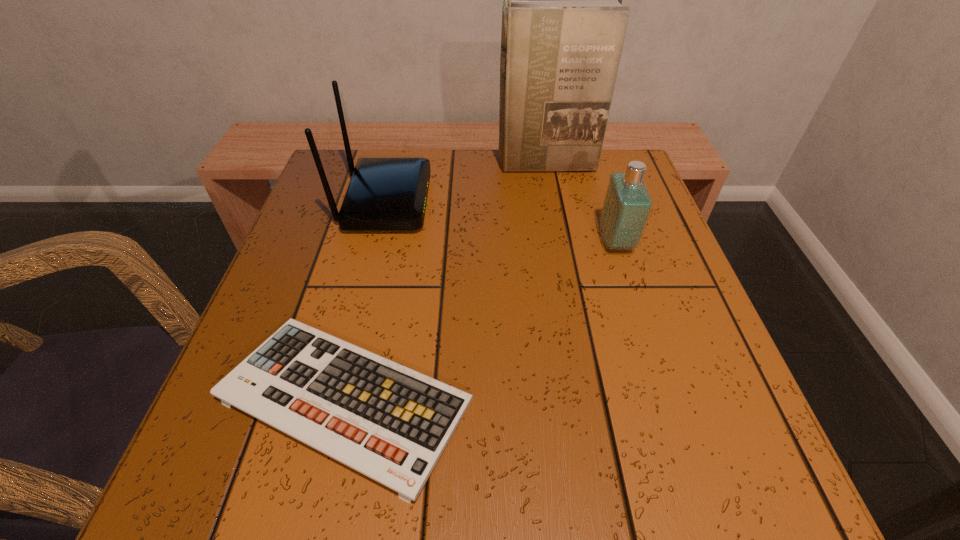
This screenshot has height=540, width=960. I want to click on free space between the shortest object and the perfume, so click(481, 321).

Find the location of a particular element. free point between the third tallest object and the router is located at coordinates (501, 221).

Identify the location of free area in between the router and the tallest object. The image size is (960, 540). (466, 183).

At what (x,y) coordinates should I click in order to perform the action: click on free space between the phonebook and the computer keyboard. Please return your answer as a coordinate pair (x, y). Looking at the image, I should click on (445, 282).

Find the location of a particular element. The height and width of the screenshot is (540, 960). free space between the computer keyboard and the router is located at coordinates (366, 301).

Locate an element on the screen. This screenshot has width=960, height=540. unoccupied position between the router and the computer keyboard is located at coordinates (366, 301).

This screenshot has width=960, height=540. In order to click on free space between the third shortest object and the second shortest object in this screenshot , I will do `click(501, 221)`.

In order to click on the third closest object to the shortest object in this screenshot , I will do `click(563, 26)`.

Find the location of a particular element. The width and height of the screenshot is (960, 540). object that stands as the second closest to the perfume is located at coordinates (391, 423).

This screenshot has height=540, width=960. Identify the location of free space that satisfies the following two spatial constraints: 1. on the front-facing side of the shortest object; 2. on the right side of the router. (337, 400).